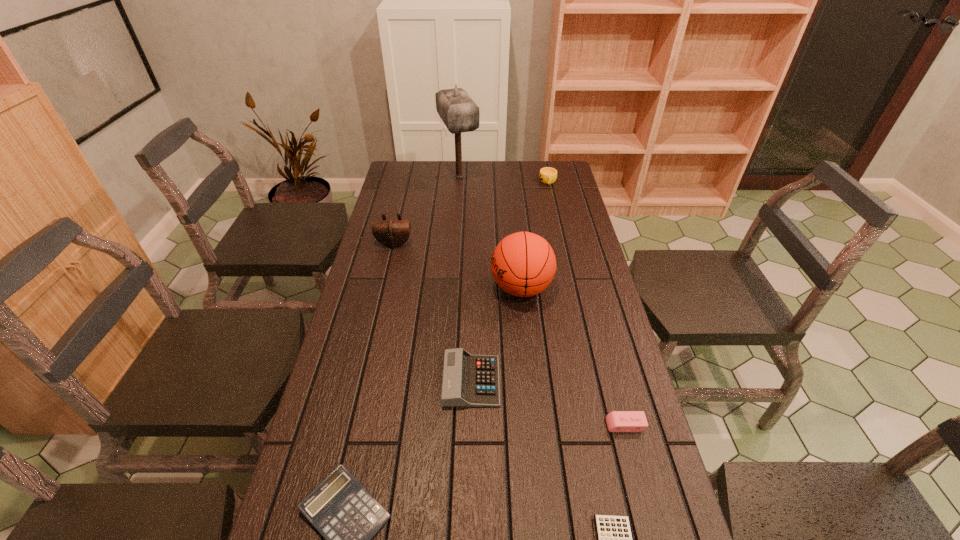
This screenshot has width=960, height=540. I want to click on the tallest object, so coord(458,111).

Locate an element on the screen. basketball is located at coordinates (523, 264).

Where is `the seventh shortest object`? The image size is (960, 540). the seventh shortest object is located at coordinates (523, 264).

Locate an element on the screen. The height and width of the screenshot is (540, 960). pouch is located at coordinates (392, 233).

I want to click on the sixth nearest object, so click(392, 233).

Image resolution: width=960 pixels, height=540 pixels. What are the coordinates of `cup` in the screenshot? It's located at (547, 175).

Find the location of `the fourth nearest object`. the fourth nearest object is located at coordinates (469, 380).

Locate an element on the screen. This screenshot has height=540, width=960. the tallest calculator is located at coordinates (469, 380).

Locate an element on the screen. eraser is located at coordinates (617, 421).

I want to click on free space located 0.230m on the front of the mallet, so click(x=456, y=222).